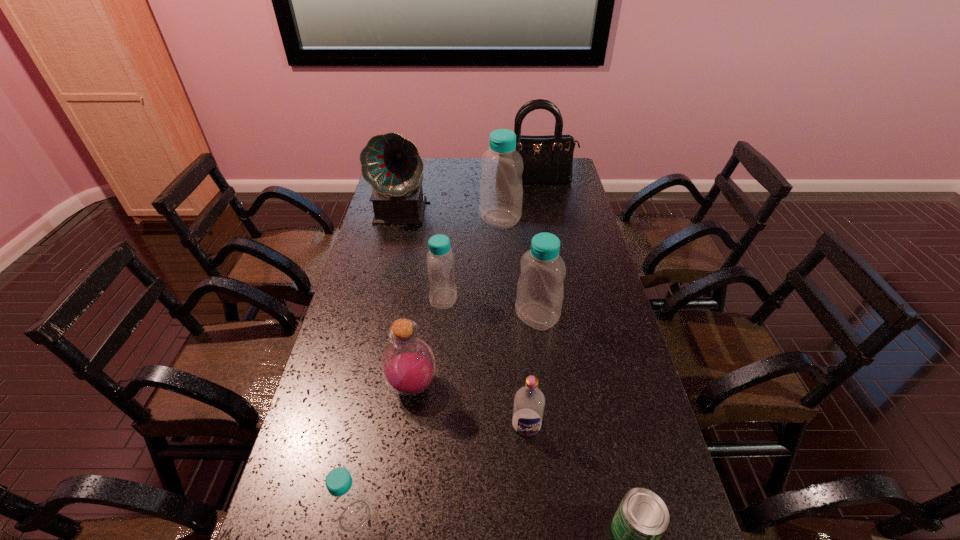
Locate an element on the screen. Image resolution: width=960 pixels, height=540 pixels. the third nearest object is located at coordinates (529, 401).

Locate an element on the screen. the smallest blue bottle is located at coordinates [349, 505].

Identify the location of the shortest bottle. The height and width of the screenshot is (540, 960). (349, 505).

What are the coordinates of `vacant space located on the horn of the record player` in the screenshot? It's located at (397, 238).

You are a GUI agent. You are given a task and a screenshot of the screen. Output one action in this format:
    pyautogui.click(x=<x>, y=<y>)
    Task: Click on the free location located 0.060m with an open clasp on the front of the farthest object
    This screenshot has height=540, width=960.
    Given the screenshot: What is the action you would take?
    pyautogui.click(x=537, y=193)

The width and height of the screenshot is (960, 540). In order to click on vacant space located on the left of the tallest bottle in this screenshot , I will do `click(440, 219)`.

In order to click on free point located 0.070m on the left of the second tallest bottle in this screenshot , I will do `click(492, 316)`.

This screenshot has width=960, height=540. Identify the location of vacant space located on the front of the third biggest blue bottle. (438, 365).

Where is `vacant area situated 0.070m on the back of the sixth farthest object`? The image size is (960, 540). vacant area situated 0.070m on the back of the sixth farthest object is located at coordinates (418, 346).

This screenshot has width=960, height=540. I want to click on vacant space located on the label of the seventh farthest object, so click(532, 484).